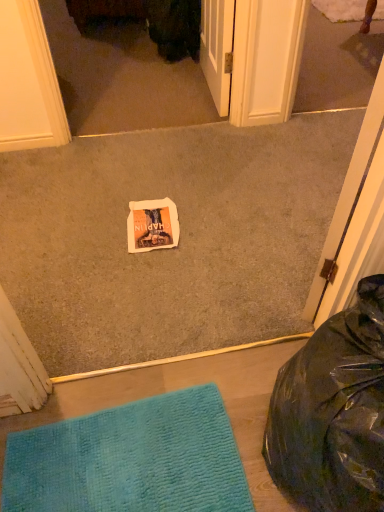
I want to click on free point in front of white paper at center, so click(x=141, y=267).